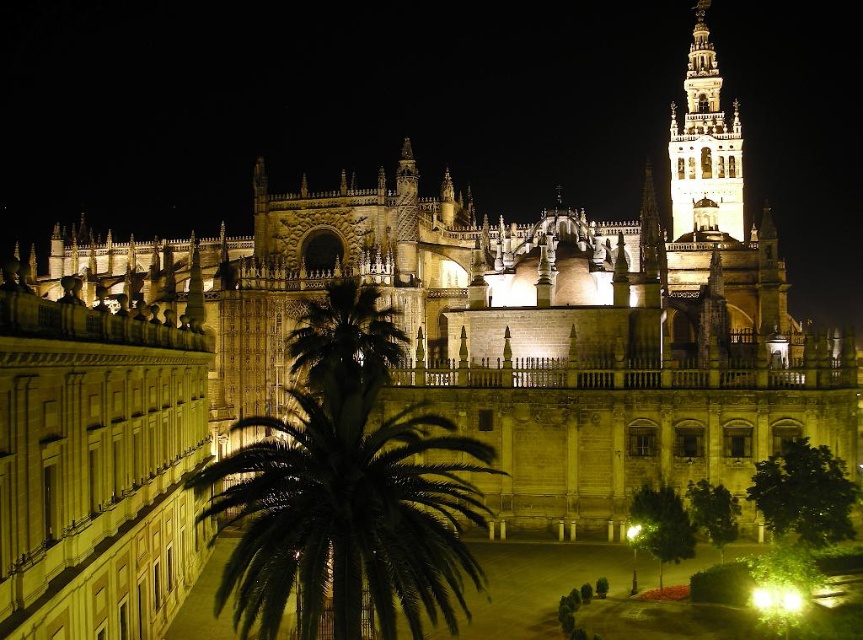
Question: Is green leafy palm at center in front of illuminated stone bell tower at upper right?

Choices:
 (A) no
 (B) yes

Answer: (B)

Question: Among these points, which one is farthest from the camera?

Choices:
 (A) (281, 476)
 (B) (702, 12)

Answer: (B)

Question: Is green leafy palm at center smaller than illuminated stone bell tower at upper right?

Choices:
 (A) yes
 (B) no

Answer: (B)

Question: Is green leafy palm at center closer to camera compared to illuminated stone bell tower at upper right?

Choices:
 (A) no
 (B) yes

Answer: (B)

Question: Which of the following is the closest to the observer?

Choices:
 (A) green leafy palm at center
 (B) illuminated stone bell tower at upper right

Answer: (A)

Question: Which of the following is the closest to the observer?

Choices:
 (A) green leafy palm at center
 (B) illuminated stone bell tower at upper right

Answer: (A)